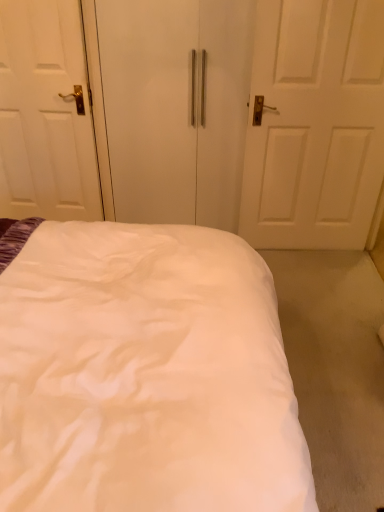
Question: Is white fabric bed at center further to the viewer compared to white glossy door at left?

Choices:
 (A) no
 (B) yes

Answer: (A)

Question: Is white fabric bed at center closer to camera compared to white glossy door at left?

Choices:
 (A) no
 (B) yes

Answer: (B)

Question: Does white fabric bed at center have a smaller size compared to white glossy door at left?

Choices:
 (A) yes
 (B) no

Answer: (B)

Question: Is white fabric bed at center not near white glossy door at left?

Choices:
 (A) yes
 (B) no

Answer: (A)

Question: Is white fabric bed at center wider than white glossy door at left?

Choices:
 (A) no
 (B) yes

Answer: (B)

Question: From their relative heights in the image, would you say white glossy door at left is taller or shorter than white fabric bed at center?

Choices:
 (A) tall
 (B) short

Answer: (A)

Question: From the image's perspective, is white glossy door at left located above or below white fabric bed at center?

Choices:
 (A) below
 (B) above

Answer: (B)

Question: Relative to white fabric bed at center, is white glossy door at left in front or behind?

Choices:
 (A) behind
 (B) front

Answer: (A)

Question: Is white glossy door at left situated inside white fabric bed at center or outside?

Choices:
 (A) inside
 (B) outside

Answer: (B)

Question: From their relative heights in the image, would you say white glossy door at left is taller or shorter than white matte wardrobe at center?

Choices:
 (A) short
 (B) tall

Answer: (A)

Question: Considering the positions of white glossy door at left and white matte wardrobe at center in the image, is white glossy door at left bigger or smaller than white matte wardrobe at center?

Choices:
 (A) big
 (B) small

Answer: (B)

Question: Is point (69, 155) closer or farther from the camera than point (201, 167)?

Choices:
 (A) closer
 (B) farther

Answer: (A)

Question: Is white glossy door at left inside the boundaries of white matte wardrobe at center, or outside?

Choices:
 (A) inside
 (B) outside

Answer: (B)

Question: Considering the positions of white fabric bed at center and white glossy door at left in the image, is white fabric bed at center taller or shorter than white glossy door at left?

Choices:
 (A) short
 (B) tall

Answer: (A)

Question: Considering the positions of point (134, 364) and point (44, 68), is point (134, 364) closer or farther from the camera than point (44, 68)?

Choices:
 (A) farther
 (B) closer

Answer: (B)